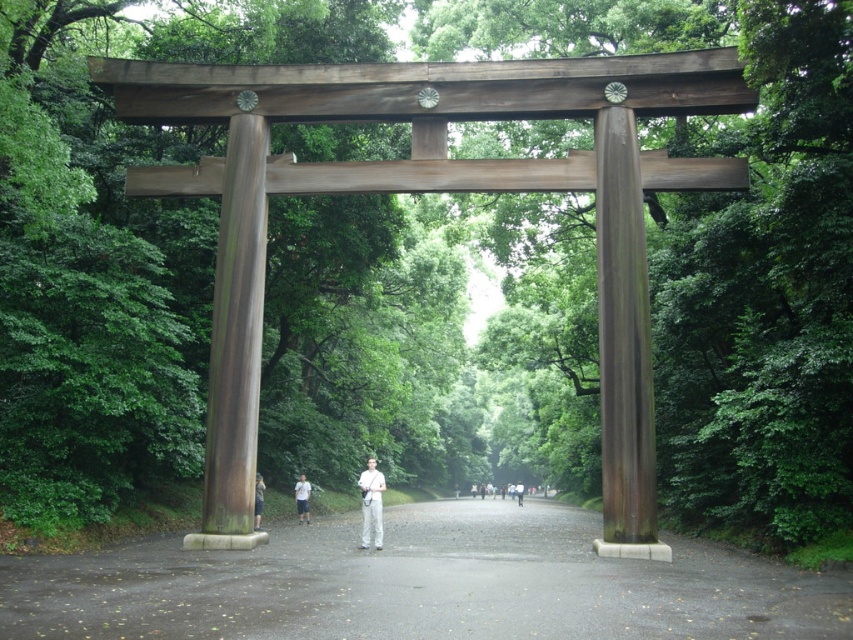
What do you see at coordinates (421, 586) in the screenshot? This screenshot has width=853, height=640. I see `dull gray asphalt at center` at bounding box center [421, 586].

Is dull gray asphalt at center below white matte pants at center?

Yes, dull gray asphalt at center is below white matte pants at center.

This screenshot has height=640, width=853. What are the coordinates of `dull gray asphalt at center` in the screenshot? It's located at (421, 586).

The width and height of the screenshot is (853, 640). Find the location of `dull gray asphalt at center`. dull gray asphalt at center is located at coordinates (421, 586).

Does white matte pants at center have a greater height compared to light gray fabric pants at center?

Incorrect, white matte pants at center's height is not larger of light gray fabric pants at center's.

Is white matte pants at center below light gray fabric pants at center?

No, white matte pants at center is not below light gray fabric pants at center.

The height and width of the screenshot is (640, 853). What do you see at coordinates (258, 500) in the screenshot?
I see `white matte pants at center` at bounding box center [258, 500].

Where is `white matte pants at center`? This screenshot has width=853, height=640. white matte pants at center is located at coordinates (258, 500).

Does point (405, 608) lie behind point (520, 500)?

No, it is in front of (520, 500).

Which is behind, point (389, 627) or point (488, 492)?

Positioned behind is point (488, 492).

Measure the distance between point [263,595] and camera.

They are 11.96 meters apart.

I want to click on dull gray asphalt at center, so click(x=421, y=586).